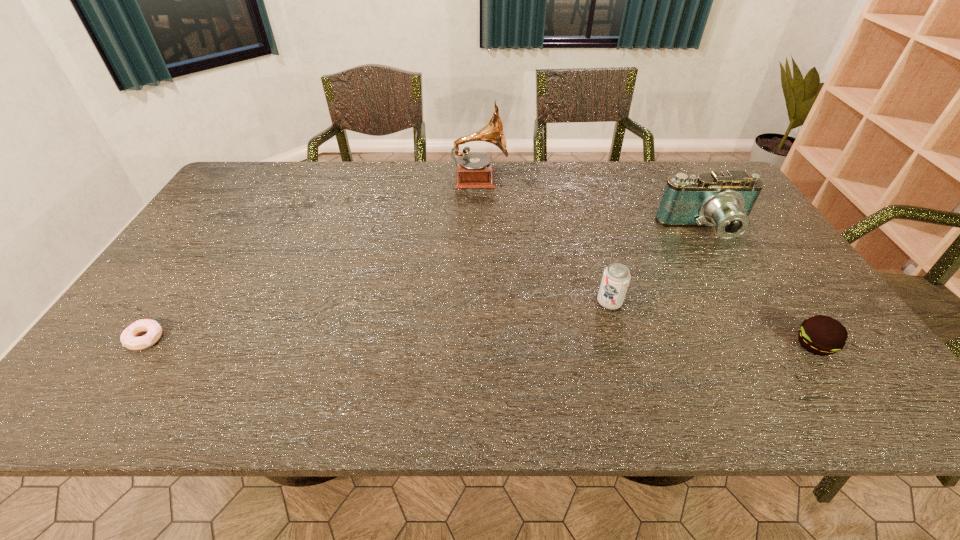
At what (x,y) coordinates should I click in order to perform the action: click on vacant space located on the front-facing side of the camcorder. Please return your answer as a coordinate pair (x, y). The height and width of the screenshot is (540, 960). Looking at the image, I should click on (725, 264).

You are a GUI agent. You are given a task and a screenshot of the screen. Output one action in this format:
    pyautogui.click(x=<x>, y=<y>)
    Task: Click on the free space located on the back of the third farthest object
    Image resolution: width=960 pixels, height=540 pixels.
    Given the screenshot: What is the action you would take?
    pyautogui.click(x=591, y=238)

Find the location of `free space located 0.090m on the front of the fourth tallest object`. free space located 0.090m on the front of the fourth tallest object is located at coordinates (851, 398).

Where is `free location located on the back of the leftmost object`? This screenshot has width=960, height=540. free location located on the back of the leftmost object is located at coordinates (203, 255).

This screenshot has height=540, width=960. I want to click on object that is at the far edge, so click(x=474, y=170).

What are the coordinates of `object that is at the left edge` in the screenshot? It's located at point(128,338).

In order to click on camcorder present at the right edge in this screenshot , I will do `click(724, 200)`.

The image size is (960, 540). Find the location of `patty at the right edge`. patty at the right edge is located at coordinates (821, 335).

Locate an element on the screen. The width and height of the screenshot is (960, 540). free space at the far edge of the desktop is located at coordinates (423, 194).

The height and width of the screenshot is (540, 960). Identify the location of vacant space at the left edge of the desktop. (121, 354).